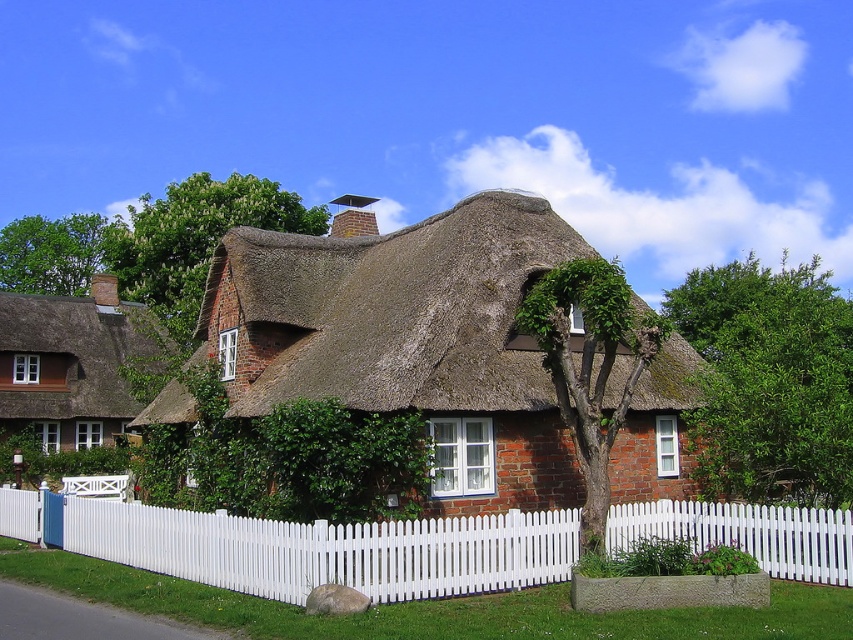
Question: Can you confirm if white picket fence at center is bigger than green leafy ivy at right?

Choices:
 (A) no
 (B) yes

Answer: (A)

Question: Is brown thatch roof at center smaller than white picket fence at center?

Choices:
 (A) no
 (B) yes

Answer: (A)

Question: Which point is closer to the camera taking this photo?

Choices:
 (A) (762, 291)
 (B) (33, 474)

Answer: (B)

Question: Is brown thatch roof at center bigger than white picket fence at center?

Choices:
 (A) no
 (B) yes

Answer: (B)

Question: Based on their relative distances, which object is nearer to the matte brown thatched roof at left?

Choices:
 (A) white picket fence at center
 (B) green leafy ivy at right

Answer: (A)

Question: Which point is closer to the camera?

Choices:
 (A) (506, 548)
 (B) (120, 346)

Answer: (A)